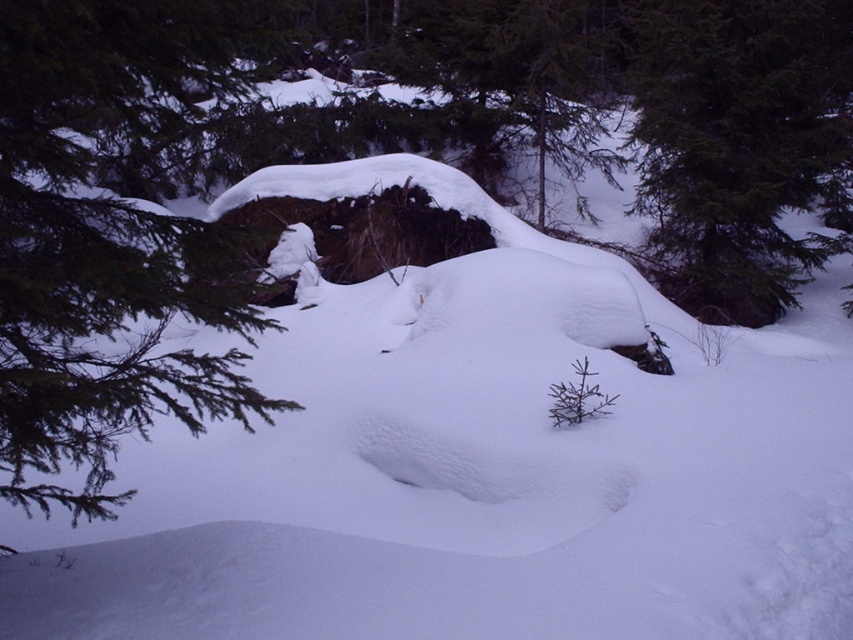
Question: Which object appears closest to the camera in this image?

Choices:
 (A) green textured pine branch at left
 (B) green textured tree at upper right

Answer: (A)

Question: Is green textured pine branch at left in front of green textured tree at upper right?

Choices:
 (A) no
 (B) yes

Answer: (B)

Question: Does green textured pine branch at left appear on the right side of green textured tree at upper right?

Choices:
 (A) yes
 (B) no

Answer: (B)

Question: Which point is closer to the camera?

Choices:
 (A) (138, 307)
 (B) (645, 200)

Answer: (A)

Question: Which point is farther to the camera?

Choices:
 (A) green textured pine branch at left
 (B) green textured tree at upper right

Answer: (B)

Question: Is green textured pine branch at left wider than green textured tree at upper right?

Choices:
 (A) no
 (B) yes

Answer: (A)